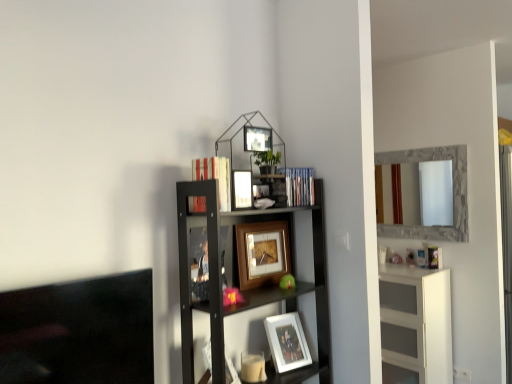
Question: Based on their sizes in the image, would you say hardcover book at upper center, the 1th book in the left-to-right sequence, is bigger or smaller than white matte picture frame at lower center, acting as the 1th picture frame starting from the bottom?

Choices:
 (A) big
 (B) small

Answer: (B)

Question: Would you say hardcover book at upper center, the 2th book in the back-to-front sequence, is to the left or to the right of white matte picture frame at lower center, positioned as the fourth picture frame in top-to-bottom order, in the picture?

Choices:
 (A) left
 (B) right

Answer: (A)

Question: Which of these objects is positioned farthest from the hardcover book at upper center, which is the first book in front-to-back order?

Choices:
 (A) stone-framed mirror at right
 (B) black wood shelf at upper right
 (C) white glossy cabinet at right
 (D) blue plastic book at upper right, arranged as the second book when viewed from the front
 (E) white matte picture frame at lower center, positioned as the fourth picture frame in top-to-bottom order

Answer: (A)

Question: Which object is positioned farthest from the white glossy cabinet at right?

Choices:
 (A) black wood shelf at upper right
 (B) wooden picture frame at center, which appears as the 3th picture frame when viewed from the top
 (C) hardcover book at upper center, which is the first book in front-to-back order
 (D) blue plastic book at upper right, the 1th book positioned from the right
 (E) metallic silver picture frame at upper center, the 1th picture frame in the top-to-bottom sequence

Answer: (C)